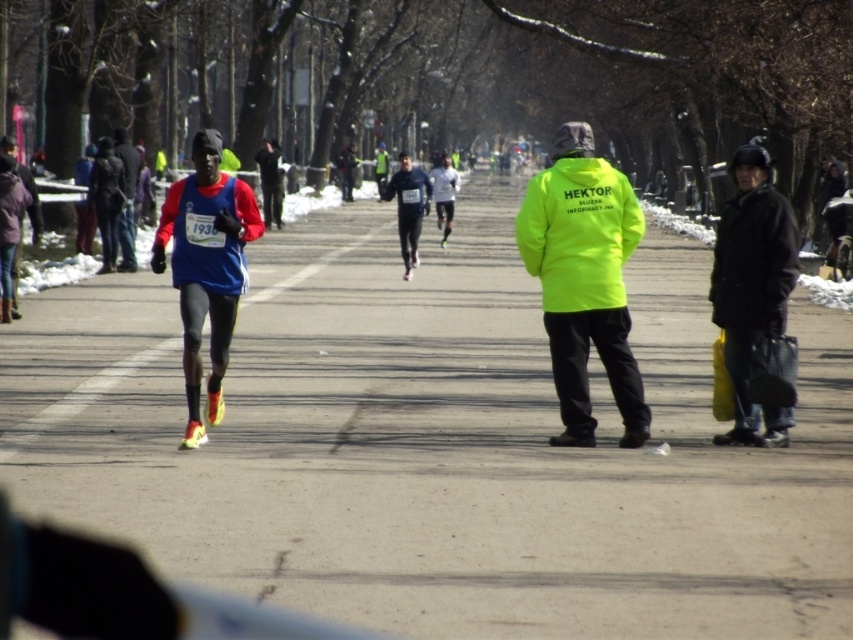
Where is `blue fabric runner at center`? blue fabric runner at center is located at coordinates (408, 208).

This screenshot has height=640, width=853. Describe the element at coordinates (437, 444) in the screenshot. I see `gray asphalt road at center` at that location.

Is point (372, 248) farther from viewer compared to point (453, 198)?

No, it is in front of (453, 198).

I want to click on gray asphalt road at center, so click(437, 444).

Who is positioned more to the left, black matte jacket at right or blue fabric running suit at left?

From the viewer's perspective, blue fabric running suit at left appears more on the left side.

Locate an element on the screen. black matte jacket at right is located at coordinates (752, 288).